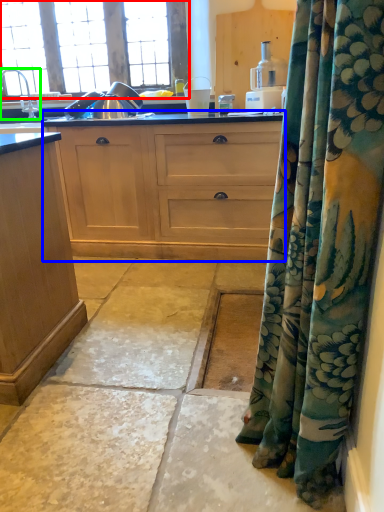
Question: Estimate the real-world distances between objects in this image. Which object is farther from window (highlighted by a red box), cabinetry (highlighted by a blue box) or faucet (highlighted by a green box)?

Choices:
 (A) cabinetry
 (B) faucet

Answer: (A)